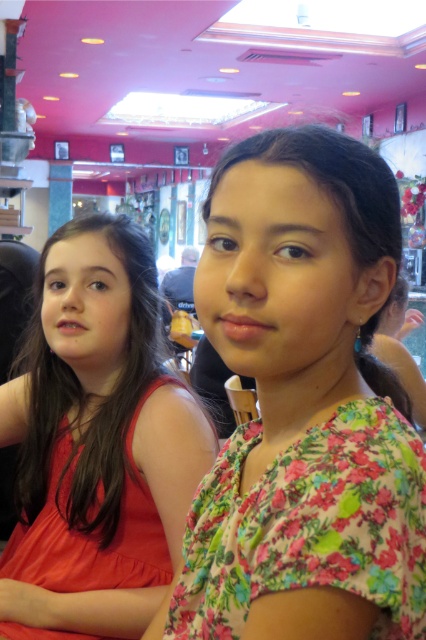
What are the coordinates of the floral fabric dress at center?

The floral fabric dress at center is located at coordinates point (296, 392).

You are standing at the position of point [49,285] and want to walk towards the camera. Which direction should you move relative to point [394,552]?

To walk towards the camera from point [49,285], you should move towards point [394,552] since it is in front of you.

You are a photographer trying to capture the floral fabric dress at center and the matte orange dress at center in a single shot. Which dress should you focus on to ensure the one behind is also in focus?

The floral fabric dress at center is positioned over matte orange dress at center, so focusing on the floral fabric dress at center will ensure the matte orange dress at center behind it is also in focus.